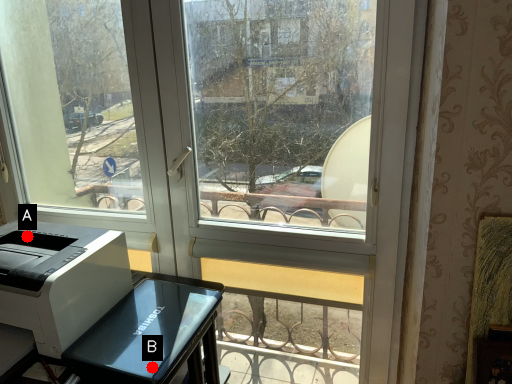
Question: Two points are circled on the image, labeled by A and B beside each circle. Which point appears closest to the camera in this image?

Choices:
 (A) A is closer
 (B) B is closer

Answer: (B)